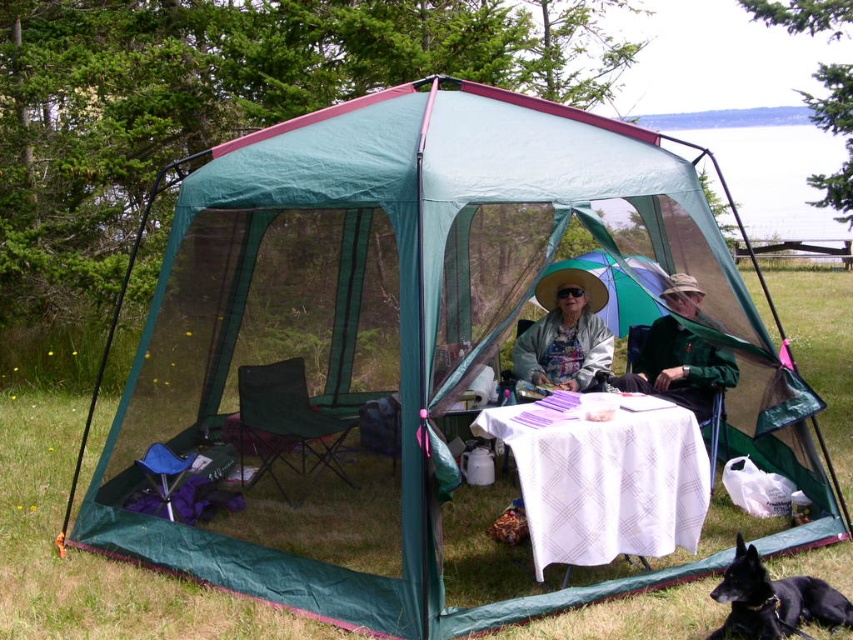
Does white cloth table at center have a larger size compared to black fur dog at lower right?

Yes, white cloth table at center is bigger than black fur dog at lower right.

Does point (556, 458) come farther from viewer compared to point (787, 611)?

Yes, point (556, 458) is behind point (787, 611).

You are a GUI agent. You are given a task and a screenshot of the screen. Output one action in this format:
    pyautogui.click(x=<x>, y=<y>)
    Task: Click on the white cloth table at center
    Image resolution: width=853 pixels, height=640 pixels.
    Given the screenshot: What is the action you would take?
    pyautogui.click(x=605, y=476)

From the picture: Which is more to the left, white cloth table at center or green fabric hat at upper center?

white cloth table at center is more to the left.

The height and width of the screenshot is (640, 853). I want to click on white cloth table at center, so click(605, 476).

Locate an element on the screen. This screenshot has height=640, width=853. white cloth table at center is located at coordinates (605, 476).

Between white cloth table at center and matte green hat at center, which one is positioned lower?

Positioned lower is white cloth table at center.

Is white cloth table at center to the left of matte green hat at center from the viewer's perspective?

Correct, you'll find white cloth table at center to the left of matte green hat at center.

What are the coordinates of `white cloth table at center` in the screenshot? It's located at (605, 476).